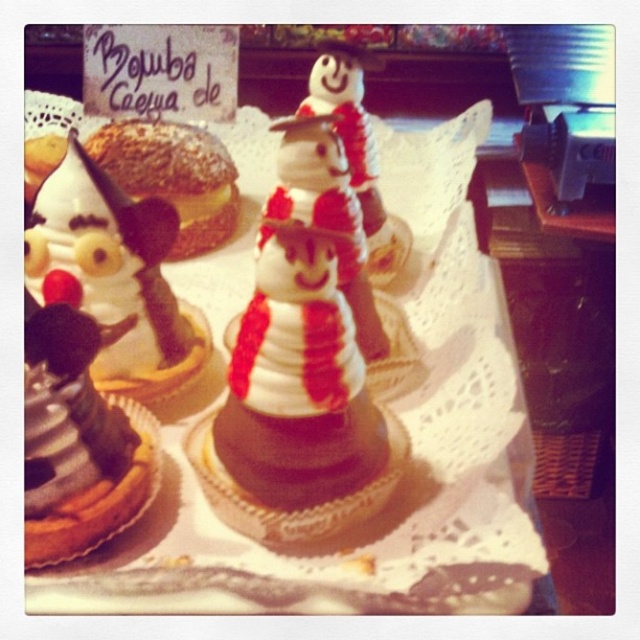
Question: Can you confirm if white chocolate ice cream at left is positioned below white frosting snowman at center?

Choices:
 (A) yes
 (B) no

Answer: (A)

Question: Is the position of white chocolate snowman at center less distant than that of white chocolate ice cream at left?

Choices:
 (A) yes
 (B) no

Answer: (A)

Question: Among these objects, which one is farthest from the camera?

Choices:
 (A) chocolate frosted cake at left
 (B) glazed sugar donut at center

Answer: (B)

Question: Can you confirm if glazed sugar donut at center is wider than white frosting snowman at center?

Choices:
 (A) yes
 (B) no

Answer: (A)

Question: Which point is closer to the camera taking this photo?

Choices:
 (A) (67, 340)
 (B) (307, 154)
 (C) (44, 204)
 (D) (323, 344)

Answer: (A)

Question: Which object is the farthest from the white frosting snowman at center?

Choices:
 (A) white chocolate snowman at center
 (B) white chocolate ice cream at left
 (C) glazed sugar donut at center
 (D) chocolate frosted cake at left

Answer: (C)